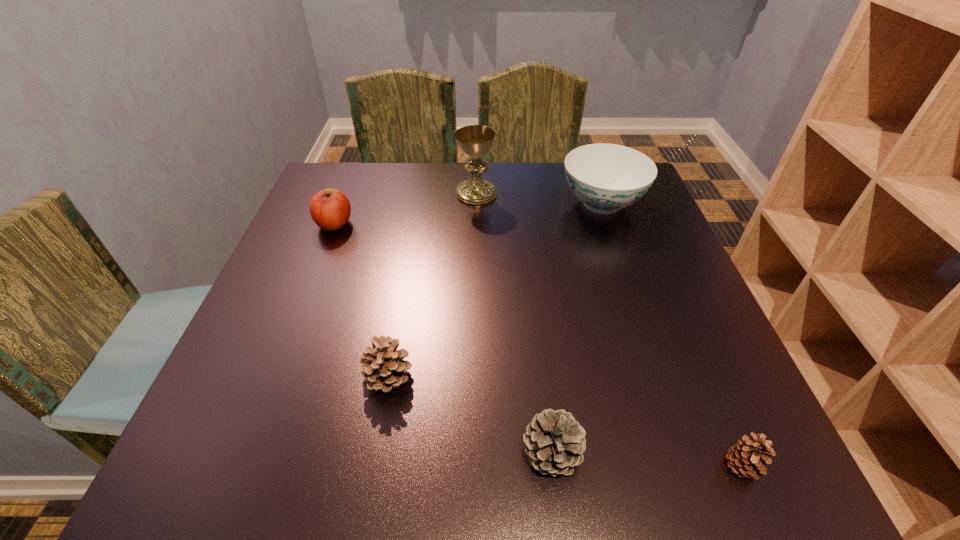
Where is `unoccupied area between the third object from right to left and the farthest pinecone`? This screenshot has height=540, width=960. unoccupied area between the third object from right to left and the farthest pinecone is located at coordinates (469, 414).

Find the location of `free space between the rightmost pinecone and the second pinecone from left to right`. free space between the rightmost pinecone and the second pinecone from left to right is located at coordinates (647, 460).

Where is `empty space between the chinaware and the apple`? empty space between the chinaware and the apple is located at coordinates (468, 214).

Identify the location of unoccupied position between the shortest object and the chinaware. Image resolution: width=960 pixels, height=540 pixels. (672, 335).

Find the location of a particular element. The height and width of the screenshot is (540, 960). vacant space in between the fifth object from right to left and the fourth object from right to left is located at coordinates (432, 284).

Choose which object is the third nearest neighbor to the chinaware. Please provide its 2D coordinates. Your answer should be formatted as a tuple, i.e. [(x, y)], where the tuple contains the x and y coordinates of a point satisfying the conditions above.

[(555, 442)]

Select which object appears as the fifth closest to the chinaware. Please provide its 2D coordinates. Your answer should be formatted as a tuple, i.e. [(x, y)], where the tuple contains the x and y coordinates of a point satisfying the conditions above.

[(747, 457)]

You are a GUI agent. You are given a task and a screenshot of the screen. Output one action in this format:
    pyautogui.click(x=<x>, y=<y>)
    Task: Click on the pinecone that is the nearest to the leftmost pinecone
    
    Given the screenshot: What is the action you would take?
    pyautogui.click(x=555, y=442)

Select which pinecone appears as the closest to the rightmost pinecone. Please provide its 2D coordinates. Your answer should be formatted as a tuple, i.e. [(x, y)], where the tuple contains the x and y coordinates of a point satisfying the conditions above.

[(555, 442)]

This screenshot has width=960, height=540. What are the coordinates of `free location that satisfies the following two spatial constraints: 1. on the front side of the leftmost object; 2. on the left side of the fourth object from left to right` in the screenshot? It's located at (245, 453).